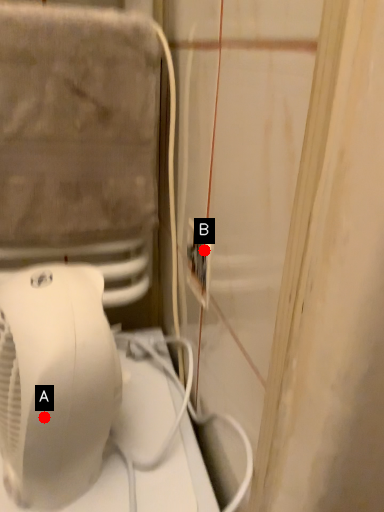
Question: Two points are circled on the image, labeled by A and B beside each circle. Which of the following is the closest to the observer?

Choices:
 (A) A is closer
 (B) B is closer

Answer: (A)